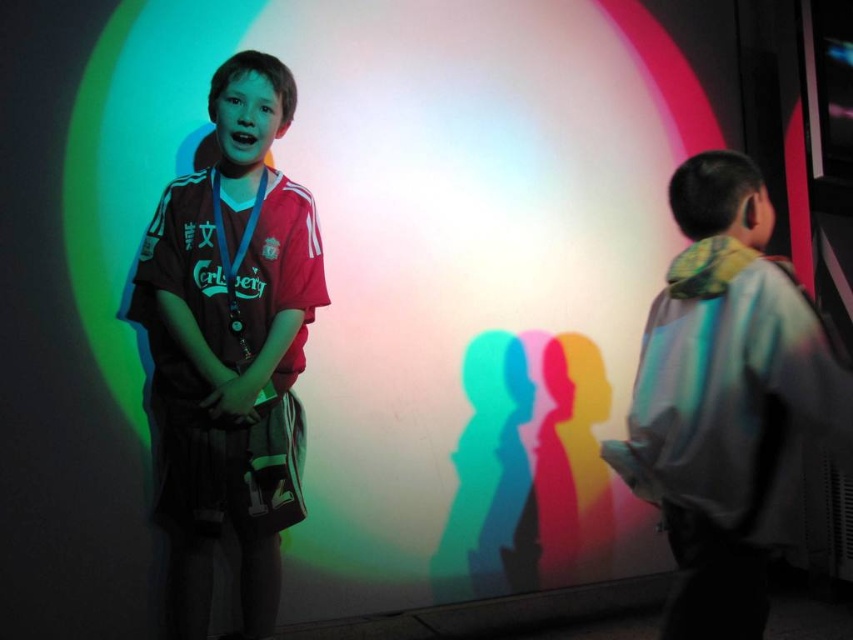
Can you confirm if matte red jersey at center is taller than light blue fabric jacket at right?

Yes, matte red jersey at center is taller than light blue fabric jacket at right.

Does matte red jersey at center have a greater width compared to light blue fabric jacket at right?

Yes, matte red jersey at center is wider than light blue fabric jacket at right.

Is point (225, 385) behind point (654, 412)?

Yes, it is behind point (654, 412).

Image resolution: width=853 pixels, height=640 pixels. I want to click on matte red jersey at center, so click(x=230, y=348).